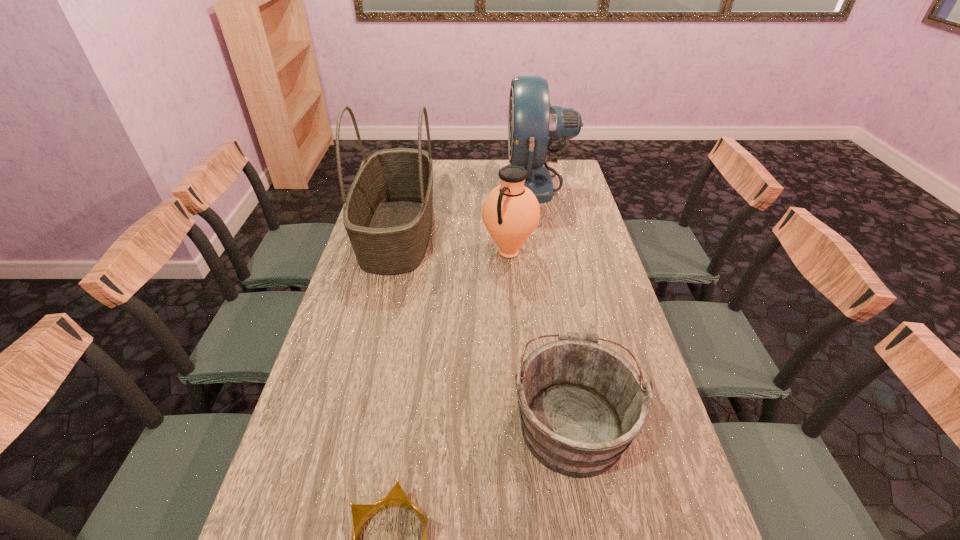
I want to click on vacant space situated on the left of the wine bucket, so click(427, 422).

At what (x,y) coordinates should I click in order to perform the action: click on object that is at the far edge. Please return your answer as a coordinate pair (x, y). Looking at the image, I should click on (533, 124).

Identify the location of object positioned at the left edge. (388, 212).

Find the location of `fan at the right edge`. fan at the right edge is located at coordinates (533, 124).

You are a GUI agent. You are given a task and a screenshot of the screen. Output one action in this format:
    pyautogui.click(x=<x>, y=<y>)
    Task: Click on the wine bucket positioned at the right edge
    This screenshot has width=960, height=540.
    Given the screenshot: What is the action you would take?
    pyautogui.click(x=581, y=404)

What are the coordinates of `object positioned at the far right corner` in the screenshot? It's located at click(533, 124).

Locate an element on the screen. free region at the far edge is located at coordinates 491,167.

You are a GUI agent. You are given a task and a screenshot of the screen. Output one action in this format:
    pyautogui.click(x=<x>, y=<y>)
    Task: Click on the vacant space at the left edge
    The width and height of the screenshot is (960, 540).
    Given the screenshot: What is the action you would take?
    pyautogui.click(x=347, y=507)

This screenshot has width=960, height=540. In the image, there is a desktop. Find the location of `free space at the right edge`. free space at the right edge is located at coordinates (664, 422).

In the image, there is a desktop. Where is `vacant space at the far right corner`? vacant space at the far right corner is located at coordinates (564, 178).